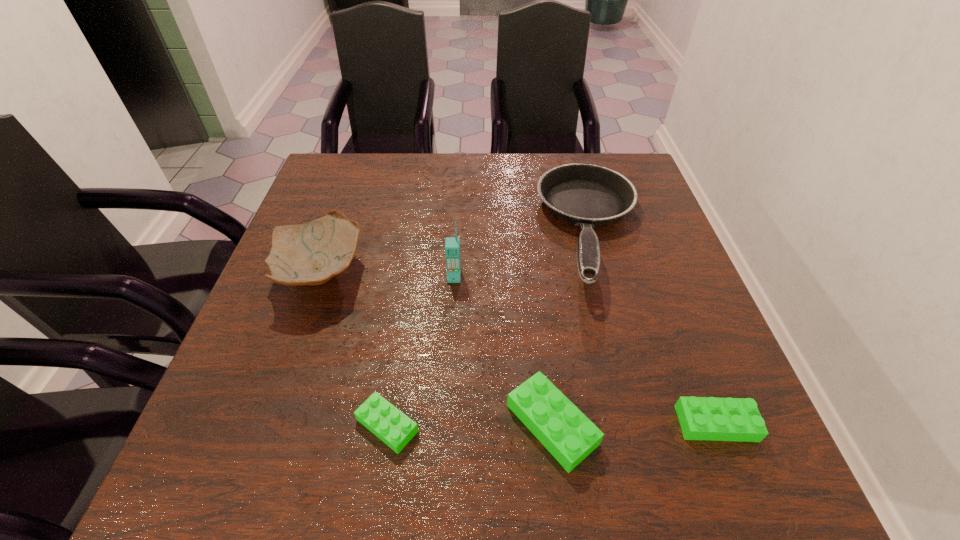
Select which Lego is the closest to the tallest Lego. Please provide its 2D coordinates. Your answer should be formatted as a tuple, i.e. [(x, y)], where the tuple contains the x and y coordinates of a point satisfying the conditions above.

[(701, 418)]

Where is `free location that satisfies the following two spatial constraints: 1. on the keypad of the cellular telephone; 2. on the left side of the fifth tallest object`? Image resolution: width=960 pixels, height=540 pixels. free location that satisfies the following two spatial constraints: 1. on the keypad of the cellular telephone; 2. on the left side of the fifth tallest object is located at coordinates (445, 423).

At what (x,y) coordinates should I click in order to perform the action: click on free location that satisfies the following two spatial constraints: 1. on the front side of the frying pan; 2. on the left side of the rightmost Lego. Please return your answer as a coordinate pair (x, y). Looking at the image, I should click on (644, 423).